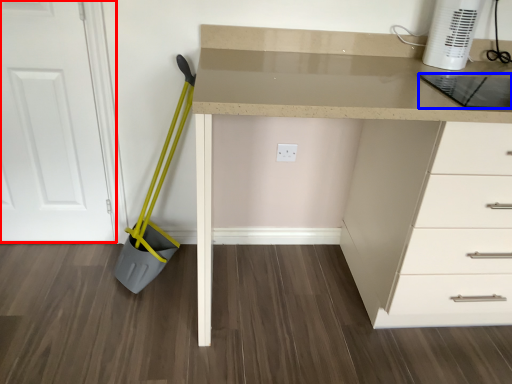
Question: Which object appears farthest to the camera in this image, door (highlighted by a red box) or kitchen appliance (highlighted by a blue box)?

Choices:
 (A) door
 (B) kitchen appliance

Answer: (A)